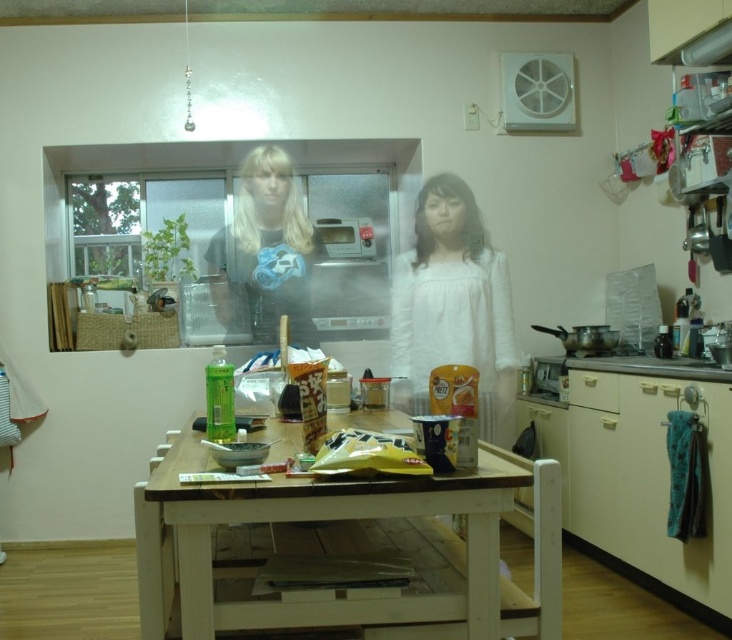
Question: Is wooden table at center wider than blonde hair at center?

Choices:
 (A) yes
 (B) no

Answer: (A)

Question: Is wooden table at center wider than white cotton shirt at center?

Choices:
 (A) yes
 (B) no

Answer: (A)

Question: Can you confirm if white cotton shirt at center is thinner than blonde hair at center?

Choices:
 (A) no
 (B) yes

Answer: (B)

Question: Considering the real-world distances, which object is closest to the wooden table at center?

Choices:
 (A) white cotton shirt at center
 (B) blonde hair at center

Answer: (A)

Question: Which point is farther from the camera taking this photo?

Choices:
 (A) click(x=255, y=227)
 (B) click(x=507, y=360)
 (C) click(x=244, y=580)

Answer: (A)

Question: Among these objects, which one is farthest from the camera?

Choices:
 (A) blonde hair at center
 (B) wooden table at center

Answer: (A)